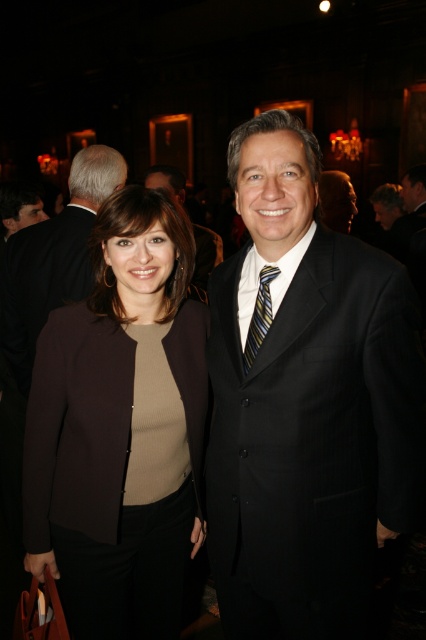
You are a photographer at the event and need to ensure that both the black pinstripe suit at center and the striped silk tie at center are visible in the frame. Considering their sizes, which one might require you to adjust your camera angle to avoid cropping?

The black pinstripe suit at center is wider than the striped silk tie at center, so you may need to adjust the camera angle to accommodate its larger width to ensure it isn not cropped.

Consider the image. You are a photographer at this event and need to adjust the camera focus. Since the black pinstripe suit at center and the matte brown blazer at center are both in the frame, which one should you focus on first if you want to prioritize the taller clothing item?

The matte brown blazer at center is taller than the black pinstripe suit at center, so you should focus on the matte brown blazer at center first.

In the scene shown: You are a photographer at this event and want to capture a photo that includes both the matte black suit at left and the striped silk tie at center. Based on their positions, which one should you focus on first to ensure both are in frame?

The matte black suit at left is positioned on the left side of striped silk tie at center, so you should focus on the matte black suit at left first to ensure both are in frame.